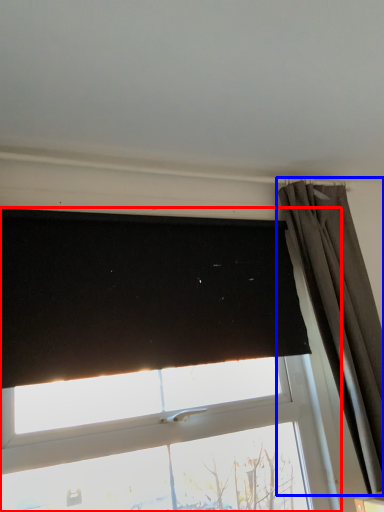
Question: Which object appears closest to the camera in this image, window (highlighted by a red box) or curtain (highlighted by a blue box)?

Choices:
 (A) window
 (B) curtain

Answer: (A)